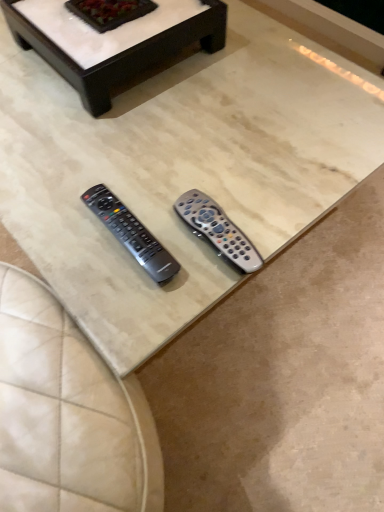
Question: Can you confirm if white marble coffee table at upper center, which appears as the second coffee table when viewed from the front, is taller than silver metallic remote at center, which ranks as the second remote control in right-to-left order?

Choices:
 (A) no
 (B) yes

Answer: (B)

Question: Considering the relative sizes of white marble coffee table at upper center, which ranks as the first coffee table in back-to-front order, and silver metallic remote at center, which ranks as the second remote control in right-to-left order, in the image provided, is white marble coffee table at upper center, which ranks as the first coffee table in back-to-front order, shorter than silver metallic remote at center, which ranks as the second remote control in right-to-left order,?

Choices:
 (A) no
 (B) yes

Answer: (A)

Question: Is white marble coffee table at upper center, which ranks as the first coffee table in back-to-front order, at the right side of silver metallic remote at center, which ranks as the second remote control in right-to-left order?

Choices:
 (A) no
 (B) yes

Answer: (A)

Question: From the image's perspective, is white marble coffee table at upper center, which ranks as the first coffee table in back-to-front order, above silver metallic remote at center, which is counted as the first remote control, starting from the left?

Choices:
 (A) no
 (B) yes

Answer: (B)

Question: From the image's perspective, is white marble coffee table at upper center, which appears as the second coffee table when viewed from the front, beneath silver metallic remote at center, which is counted as the first remote control, starting from the left?

Choices:
 (A) yes
 (B) no

Answer: (B)

Question: In the image, is white marble coffee table at upper center, which appears as the second coffee table when viewed from the front, positioned in front of or behind silver metallic remote at center, which ranks as the second remote control in right-to-left order?

Choices:
 (A) front
 (B) behind

Answer: (B)

Question: From the image's perspective, relative to silver metallic remote at center, which is counted as the first remote control, starting from the left, is white marble coffee table at upper center, which ranks as the first coffee table in back-to-front order, above or below?

Choices:
 (A) above
 (B) below

Answer: (A)

Question: Considering the positions of white marble coffee table at upper center, which ranks as the first coffee table in back-to-front order, and silver metallic remote at center, which ranks as the second remote control in right-to-left order, in the image, is white marble coffee table at upper center, which ranks as the first coffee table in back-to-front order, wider or thinner than silver metallic remote at center, which ranks as the second remote control in right-to-left order,?

Choices:
 (A) wide
 (B) thin

Answer: (A)

Question: Is white marble coffee table at upper center, which appears as the second coffee table when viewed from the front, inside the boundaries of silver metallic remote at center, which is counted as the first remote control, starting from the left, or outside?

Choices:
 (A) outside
 (B) inside

Answer: (A)

Question: Is beige marble coffee table at center, acting as the 2th coffee table starting from the back, bigger or smaller than white marble coffee table at upper center, which appears as the second coffee table when viewed from the front?

Choices:
 (A) big
 (B) small

Answer: (A)

Question: Considering the positions of beige marble coffee table at center, the first coffee table in the front-to-back sequence, and white marble coffee table at upper center, which ranks as the first coffee table in back-to-front order, in the image, is beige marble coffee table at center, the first coffee table in the front-to-back sequence, wider or thinner than white marble coffee table at upper center, which ranks as the first coffee table in back-to-front order,?

Choices:
 (A) thin
 (B) wide

Answer: (B)

Question: Do you think beige marble coffee table at center, acting as the 2th coffee table starting from the back, is within white marble coffee table at upper center, which appears as the second coffee table when viewed from the front, or outside of it?

Choices:
 (A) outside
 (B) inside

Answer: (A)

Question: From a real-world perspective, relative to white marble coffee table at upper center, which appears as the second coffee table when viewed from the front, is beige marble coffee table at center, the first coffee table in the front-to-back sequence, vertically above or below?

Choices:
 (A) below
 (B) above

Answer: (A)

Question: Relative to beige marble coffee table at center, the first coffee table in the front-to-back sequence, is translucent gray remote at center, arranged as the 1th remote control when viewed from the right, in front or behind?

Choices:
 (A) front
 (B) behind

Answer: (B)

Question: Considering the positions of translucent gray remote at center, positioned as the 2th remote control in left-to-right order, and beige marble coffee table at center, acting as the 2th coffee table starting from the back, in the image, is translucent gray remote at center, positioned as the 2th remote control in left-to-right order, bigger or smaller than beige marble coffee table at center, acting as the 2th coffee table starting from the back,?

Choices:
 (A) small
 (B) big

Answer: (A)